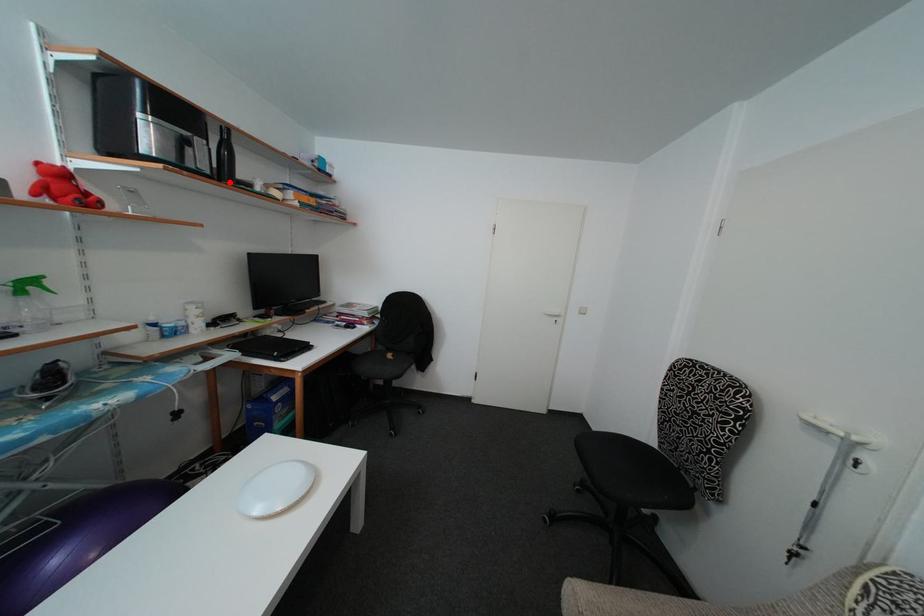
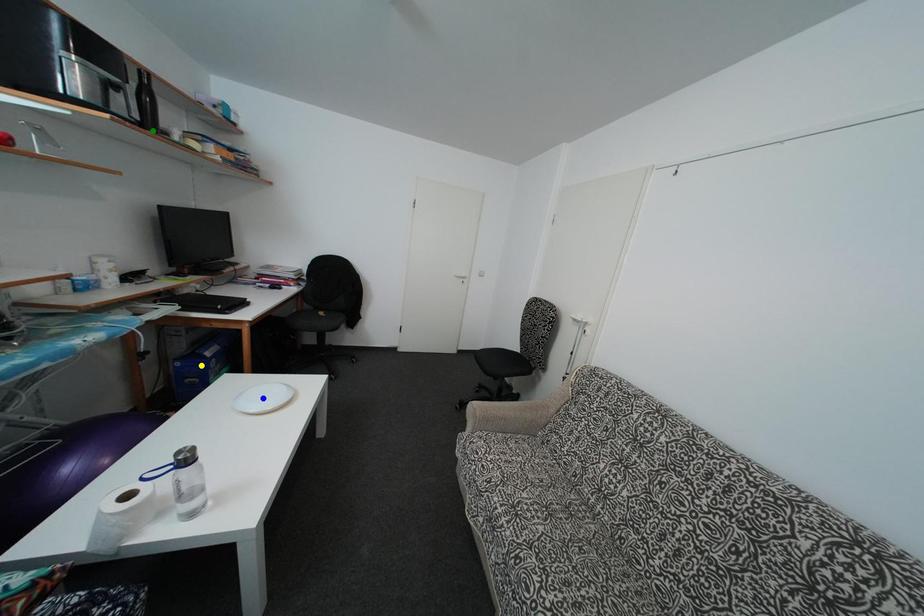
Question: I am providing you with two images of the same scene from different viewpoints. A red point is marked on the first image. You are given multiple points on the second image. Which spot in image 2 lines up with the point in image 1?

Choices:
 (A) green point
 (B) blue point
 (C) yellow point

Answer: (A)